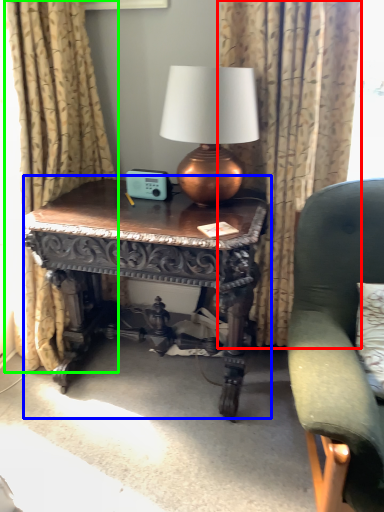
Question: Estimate the real-world distances between objects in this image. Which object is closer to curtain (highlighted by a red box), table (highlighted by a blue box) or curtain (highlighted by a green box)?

Choices:
 (A) table
 (B) curtain

Answer: (A)